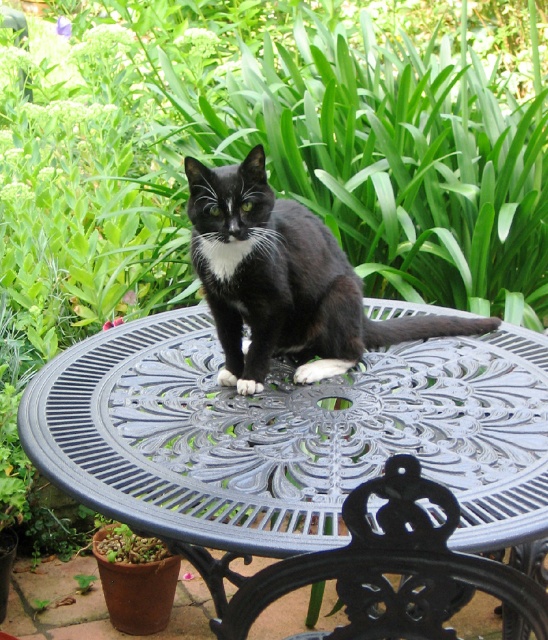
Can you confirm if matte black cat at center is positioned to the left of black cast iron chair at center?

Yes, matte black cat at center is to the left of black cast iron chair at center.

Can you confirm if matte black cat at center is bigger than black cast iron chair at center?

Indeed, matte black cat at center has a larger size compared to black cast iron chair at center.

This screenshot has height=640, width=548. I want to click on matte black cat at center, so click(284, 282).

Is matte black cat at center below metallic gray table at center?

No.

Can you confirm if matte black cat at center is smaller than metallic gray table at center?

Correct, matte black cat at center occupies less space than metallic gray table at center.

The width and height of the screenshot is (548, 640). What do you see at coordinates (284, 282) in the screenshot? I see `matte black cat at center` at bounding box center [284, 282].

Locate an element on the screen. matte black cat at center is located at coordinates pos(284,282).

Does black cast iron chair at center have a greater height compared to metallic gray table at center?

No.

Looking at this image, can you confirm if black cast iron chair at center is positioned to the left of metallic gray table at center?

In fact, black cast iron chair at center is to the right of metallic gray table at center.

This screenshot has width=548, height=640. Find the location of `black cast iron chair at center`. black cast iron chair at center is located at coordinates (392, 568).

Where is `black cast iron chair at center`? The image size is (548, 640). black cast iron chair at center is located at coordinates (392, 568).